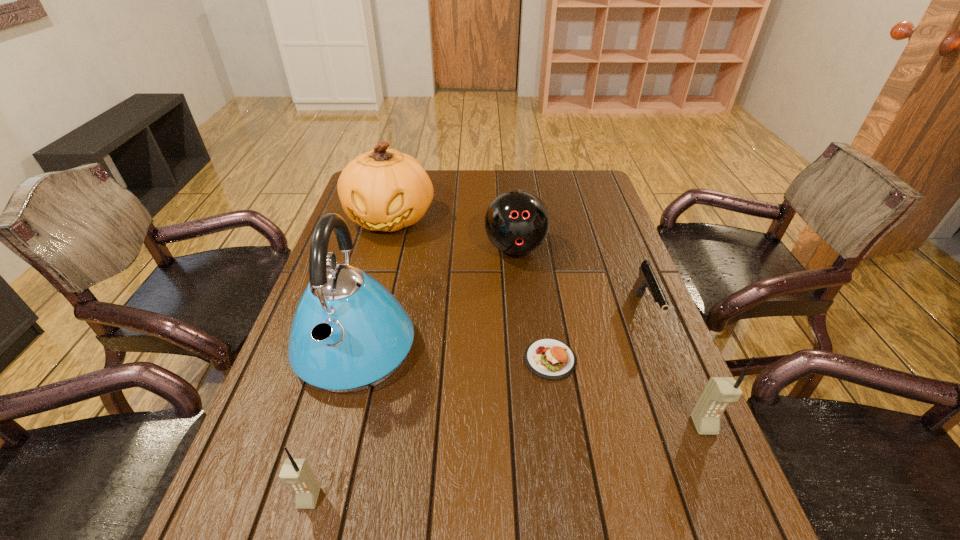
This screenshot has height=540, width=960. What are the coordinates of `vacant region located on the surface of the bowling ball near the finger holes` in the screenshot? It's located at (520, 298).

In order to click on free spot located on the front face of the pumpkin in this screenshot , I will do `click(358, 336)`.

Where is `free space located 0.140m on the right of the patty (food)`? The width and height of the screenshot is (960, 540). free space located 0.140m on the right of the patty (food) is located at coordinates (636, 359).

Where is `blank area located 0.080m at the spout of the tallest object`? blank area located 0.080m at the spout of the tallest object is located at coordinates (331, 438).

Image resolution: width=960 pixels, height=540 pixels. What are the coordinates of `free space located at the muzzle of the second shortest object` in the screenshot? It's located at (714, 485).

Where is `object that is at the far edge`? The image size is (960, 540). object that is at the far edge is located at coordinates (381, 190).

The image size is (960, 540). In order to click on object located in the near edge section of the desktop in this screenshot , I will do `click(297, 472)`.

Image resolution: width=960 pixels, height=540 pixels. Find the location of `cellular telephone located at the left edge`. cellular telephone located at the left edge is located at coordinates (297, 472).

You are a GUI agent. You are given a task and a screenshot of the screen. Output one action in this format:
    pyautogui.click(x=<x>, y=<y>)
    Task: Click on the pumpkin that is at the left edge
    This screenshot has height=540, width=960.
    Given the screenshot: What is the action you would take?
    [381, 190]

Where is `kettle that is at the left edge`? The image size is (960, 540). kettle that is at the left edge is located at coordinates (349, 333).